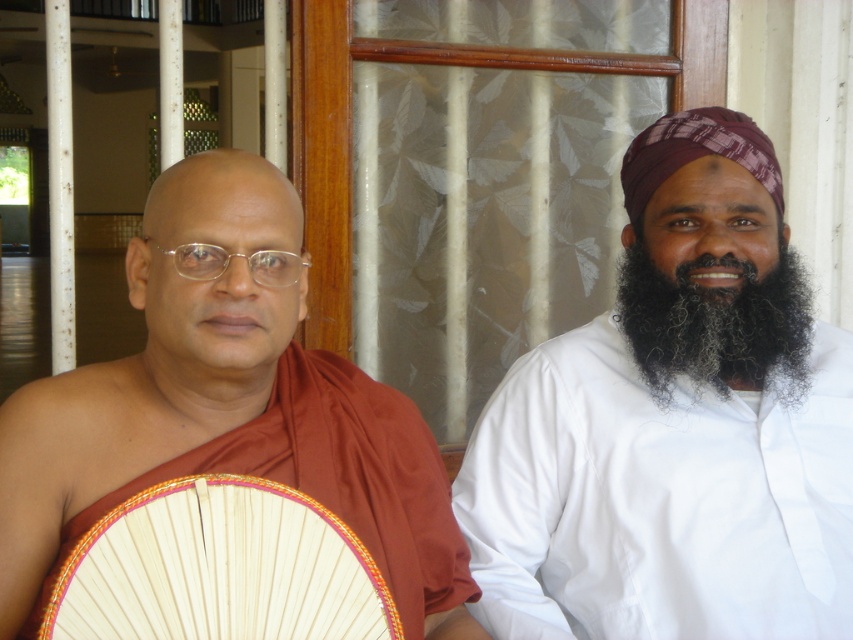
You are standing in front of the two people in the image. You want to place a small gift between them such that it is closer to the person on the right. Which coordinate point should you choose, point 1 at (625, 333) or point 2 at (704, 342)?

Point 2 at (704, 342) is closer to the person on the right, so you should choose point 2 at (704, 342) to place the gift closer to them.